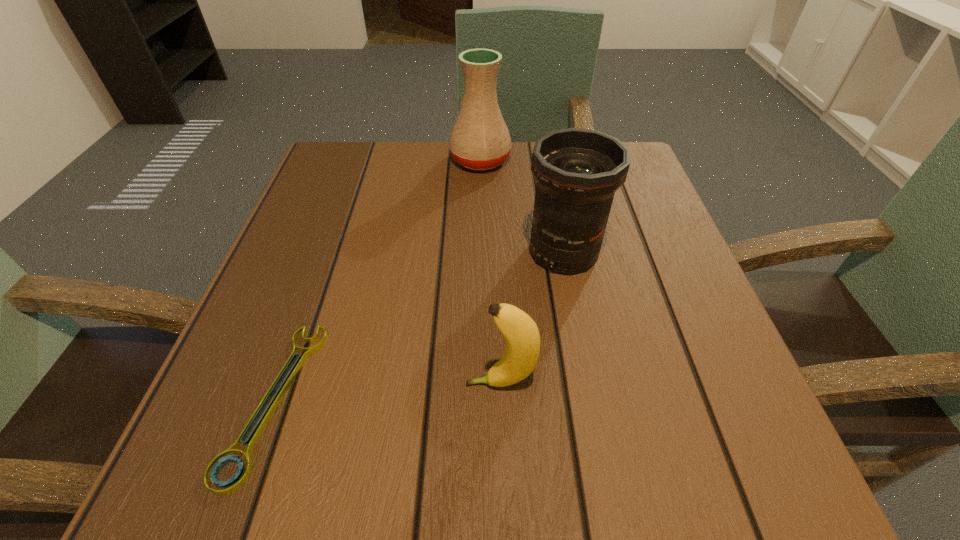
Locate an element on the screen. vacant point located between the second farthest object and the banana is located at coordinates (532, 318).

Locate an element on the screen. The image size is (960, 540). vacant area that lies between the telephoto lens and the third tallest object is located at coordinates (532, 318).

Choose which object is the third nearest neighbor to the wrench. Please provide its 2D coordinates. Your answer should be formatted as a tuple, i.e. [(x, y)], where the tuple contains the x and y coordinates of a point satisfying the conditions above.

[(480, 140)]

This screenshot has width=960, height=540. Identify the location of object that is the third closest one to the third tallest object. 480,140.

At what (x,y) coordinates should I click in order to perform the action: click on free spot that satisfies the following two spatial constraints: 1. on the front side of the telephoto lens; 2. from the stem of the second shortest object. Please return your answer as a coordinate pair (x, y). This screenshot has width=960, height=540. Looking at the image, I should click on (588, 383).

This screenshot has width=960, height=540. Identify the location of free location that satisfies the following two spatial constraints: 1. on the front side of the rightmost object; 2. from the stem of the banana. (588, 383).

I want to click on free region that satisfies the following two spatial constraints: 1. on the front side of the pottery; 2. on the left side of the telephoto lens, so click(x=480, y=252).